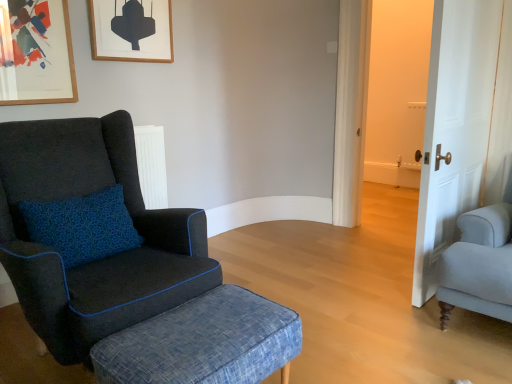
Describe the element at coordinates (38, 54) in the screenshot. I see `wooden picture frame at upper left, the 2th picture frame positioned from the back` at that location.

Where is `wooden picture frame at upper center, positioned as the 2th picture frame in left-to-right order`? wooden picture frame at upper center, positioned as the 2th picture frame in left-to-right order is located at coordinates (131, 30).

From the image's perspective, is denim textured stool at lower left above velvet dark blue armchair at left?

No, from the image's perspective, denim textured stool at lower left is not above velvet dark blue armchair at left.

Is denim textured stool at lower left far from velvet dark blue armchair at left?

denim textured stool at lower left is near velvet dark blue armchair at left, not far away.

How different are the orientations of denim textured stool at lower left and velvet dark blue armchair at left in degrees?

denim textured stool at lower left and velvet dark blue armchair at left are facing 0.00292 degrees away from each other.

Based on the photo, does denim textured stool at lower left have a smaller size compared to velvet dark blue armchair at left?

Correct, denim textured stool at lower left occupies less space than velvet dark blue armchair at left.

From the picture: Based on their positions, is wooden picture frame at upper center, which is counted as the first picture frame, starting from the right, located to the left or right of velvet dark blue armchair at left?

wooden picture frame at upper center, which is counted as the first picture frame, starting from the right, is positioned on velvet dark blue armchair at left's left side.

Considering the relative sizes of wooden picture frame at upper center, which is counted as the first picture frame, starting from the right, and velvet dark blue armchair at left in the image provided, is wooden picture frame at upper center, which is counted as the first picture frame, starting from the right, bigger than velvet dark blue armchair at left?

Actually, wooden picture frame at upper center, which is counted as the first picture frame, starting from the right, might be smaller than velvet dark blue armchair at left.

From the picture: Is wooden picture frame at upper center, which is counted as the first picture frame, starting from the right, touching velvet dark blue armchair at left?

No.

Is wooden picture frame at upper center, marked as the 1th picture frame in a back-to-front arrangement, not within velvet dark blue armchair at left?

wooden picture frame at upper center, marked as the 1th picture frame in a back-to-front arrangement, lies outside velvet dark blue armchair at left's area.

Can you confirm if denim textured stool at lower left is positioned to the left of wooden picture frame at upper center, positioned as the 2th picture frame in left-to-right order?

In fact, denim textured stool at lower left is to the right of wooden picture frame at upper center, positioned as the 2th picture frame in left-to-right order.

Which point is more forward, (183, 358) or (125, 25)?

The point (183, 358) is closer to the camera.

From the picture: Considering the relative sizes of denim textured stool at lower left and wooden picture frame at upper center, positioned as the 2th picture frame in left-to-right order, in the image provided, is denim textured stool at lower left bigger than wooden picture frame at upper center, positioned as the 2th picture frame in left-to-right order,?

Correct, denim textured stool at lower left is larger in size than wooden picture frame at upper center, positioned as the 2th picture frame in left-to-right order.

From the image's perspective, would you say denim textured stool at lower left is positioned over wooden picture frame at upper center, which ranks as the 2th picture frame in front-to-back order?

No, from the image's perspective, denim textured stool at lower left is not above wooden picture frame at upper center, which ranks as the 2th picture frame in front-to-back order.

From the picture: In terms of height, does wooden picture frame at upper left, which appears as the 1th picture frame when viewed from the left, look taller or shorter compared to white wood door at right?

In the image, wooden picture frame at upper left, which appears as the 1th picture frame when viewed from the left, appears to be shorter than white wood door at right.

Looking at their sizes, would you say wooden picture frame at upper left, which appears as the 1th picture frame when viewed from the left, is wider or thinner than white wood door at right?

Considering their sizes, wooden picture frame at upper left, which appears as the 1th picture frame when viewed from the left, looks slimmer than white wood door at right.

Considering the positions of points (35, 23) and (490, 4), is point (35, 23) farther from camera compared to point (490, 4)?

No, (35, 23) is closer to viewer.

Measure the distance from white wood door at right to wooden picture frame at upper left, which appears as the 1th picture frame when viewed from the left.

A distance of 6.52 feet exists between white wood door at right and wooden picture frame at upper left, which appears as the 1th picture frame when viewed from the left.

Could you tell me if white wood door at right is turned towards wooden picture frame at upper left, the first picture frame positioned from the front?

No, white wood door at right is not oriented towards wooden picture frame at upper left, the first picture frame positioned from the front.

Which point is more forward, (438, 114) or (29, 22)?

Point (438, 114)

From a real-world perspective, is white wood door at right beneath wooden picture frame at upper left, the 2th picture frame in the right-to-left sequence?

Yes, from a real-world perspective, white wood door at right is under wooden picture frame at upper left, the 2th picture frame in the right-to-left sequence.

From the image's perspective, count 2nd picture frames upward from the white wood door at right and point to it. Please provide its 2D coordinates.

[(131, 30)]

From the image's perspective, is wooden picture frame at upper center, positioned as the 2th picture frame in left-to-right order, beneath white wood door at right?

No, from the image's perspective, wooden picture frame at upper center, positioned as the 2th picture frame in left-to-right order, is not beneath white wood door at right.

Measure the distance between wooden picture frame at upper center, which is counted as the first picture frame, starting from the right, and white wood door at right.

5.66 feet.

Are wooden picture frame at upper center, which is counted as the first picture frame, starting from the right, and white wood door at right beside each other?

No, wooden picture frame at upper center, which is counted as the first picture frame, starting from the right, is not next to white wood door at right.

Where is `stool in front of the wooden picture frame at upper left, the first picture frame positioned from the front`? Image resolution: width=512 pixels, height=384 pixels. stool in front of the wooden picture frame at upper left, the first picture frame positioned from the front is located at coordinates (203, 342).

In terms of width, does denim textured stool at lower left look wider or thinner when compared to wooden picture frame at upper left, the 2th picture frame in the right-to-left sequence?

Considering their sizes, denim textured stool at lower left looks broader than wooden picture frame at upper left, the 2th picture frame in the right-to-left sequence.

Considering the relative sizes of denim textured stool at lower left and wooden picture frame at upper left, which appears as the 1th picture frame when viewed from the left, in the image provided, is denim textured stool at lower left smaller than wooden picture frame at upper left, which appears as the 1th picture frame when viewed from the left,?

No, denim textured stool at lower left is not smaller than wooden picture frame at upper left, which appears as the 1th picture frame when viewed from the left.

Considering the sizes of objects denim textured stool at lower left and wooden picture frame at upper left, the 2th picture frame positioned from the back, in the image provided, who is taller, denim textured stool at lower left or wooden picture frame at upper left, the 2th picture frame positioned from the back,?

With more height is wooden picture frame at upper left, the 2th picture frame positioned from the back.

At what (x,y) coordinates should I click in order to perform the action: click on stool below the velvet dark blue armchair at left (from the image's perspective). Please return your answer as a coordinate pair (x, y). Looking at the image, I should click on (203, 342).

The height and width of the screenshot is (384, 512). What are the coordinates of `picture frame that is the 2nd one above the velvet dark blue armchair at left (from a real-world perspective)` in the screenshot? It's located at (131, 30).

Considering their positions, is denim textured stool at lower left positioned closer to velvet dark blue armchair at left than wooden picture frame at upper left, the 2th picture frame in the right-to-left sequence?

Based on the image, denim textured stool at lower left appears to be nearer to velvet dark blue armchair at left.

Looking at the image, which one is located further to wooden picture frame at upper left, the 2th picture frame in the right-to-left sequence, denim textured stool at lower left or wooden picture frame at upper center, marked as the 1th picture frame in a back-to-front arrangement?

Among the two, denim textured stool at lower left is located further to wooden picture frame at upper left, the 2th picture frame in the right-to-left sequence.

Considering their positions, is wooden picture frame at upper left, the 2th picture frame positioned from the back, positioned closer to denim textured stool at lower left than wooden picture frame at upper center, which ranks as the 2th picture frame in front-to-back order?

wooden picture frame at upper left, the 2th picture frame positioned from the back, lies closer to denim textured stool at lower left than the other object.

Based on their spatial positions, is white wood door at right or wooden picture frame at upper left, the first picture frame positioned from the front, closer to velvet dark blue armchair at left?

Among the two, wooden picture frame at upper left, the first picture frame positioned from the front, is located nearer to velvet dark blue armchair at left.

Based on the photo, when comparing their distances from wooden picture frame at upper center, which is counted as the first picture frame, starting from the right, does denim textured stool at lower left or velvet dark blue armchair at left seem closer?

velvet dark blue armchair at left.

Based on their spatial positions, is denim textured stool at lower left or white wood door at right further from wooden picture frame at upper center, which ranks as the 2th picture frame in front-to-back order?

The object further to wooden picture frame at upper center, which ranks as the 2th picture frame in front-to-back order, is denim textured stool at lower left.

When comparing their distances from white wood door at right, does velvet dark blue armchair at left or wooden picture frame at upper left, the 2th picture frame positioned from the back, seem closer?

velvet dark blue armchair at left lies closer to white wood door at right than the other object.

Considering their positions, is velvet dark blue armchair at left positioned closer to wooden picture frame at upper center, positioned as the 2th picture frame in left-to-right order, than denim textured stool at lower left?

Among the two, velvet dark blue armchair at left is located nearer to wooden picture frame at upper center, positioned as the 2th picture frame in left-to-right order.

The height and width of the screenshot is (384, 512). In order to click on stool between velvet dark blue armchair at left and white wood door at right from left to right in this screenshot , I will do `click(203, 342)`.

At what (x,y) coordinates should I click in order to perform the action: click on picture frame between velvet dark blue armchair at left and wooden picture frame at upper center, which ranks as the 2th picture frame in front-to-back order, in the front-back direction. Please return your answer as a coordinate pair (x, y). Looking at the image, I should click on (38, 54).

Where is `stool between wooden picture frame at upper center, marked as the 1th picture frame in a back-to-front arrangement, and white wood door at right, in the horizontal direction`? stool between wooden picture frame at upper center, marked as the 1th picture frame in a back-to-front arrangement, and white wood door at right, in the horizontal direction is located at coordinates (203, 342).

I want to click on picture frame between wooden picture frame at upper left, which appears as the 1th picture frame when viewed from the left, and white wood door at right, so click(131, 30).